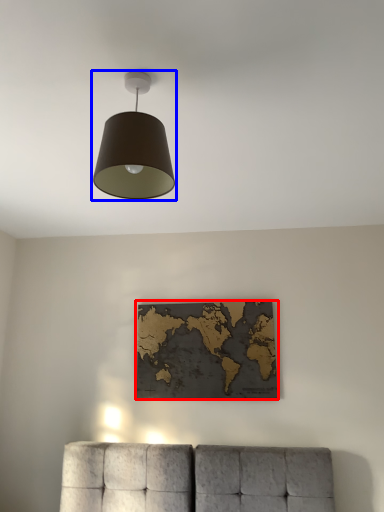
Question: Which object appears farthest to the camera in this image, picture frame (highlighted by a red box) or lamp (highlighted by a blue box)?

Choices:
 (A) picture frame
 (B) lamp

Answer: (A)